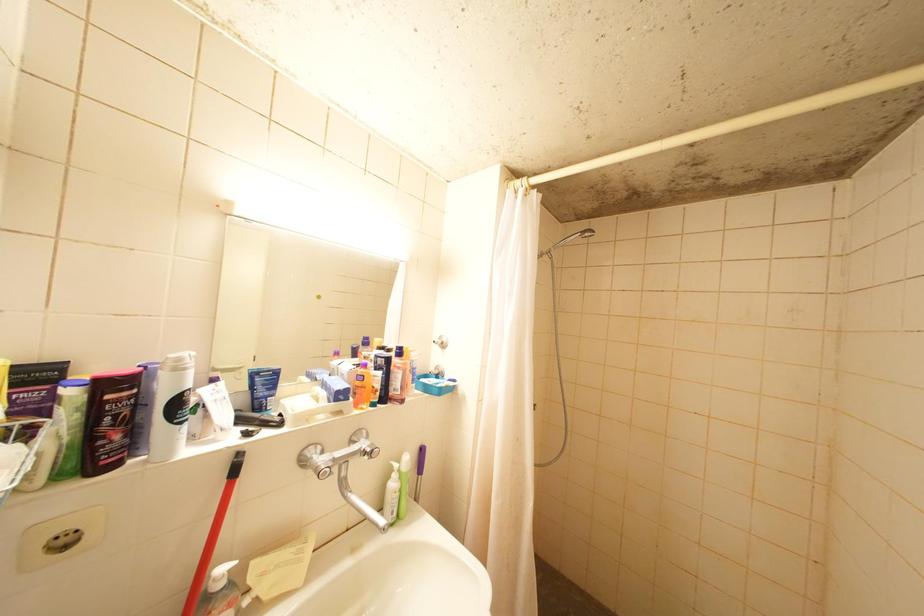
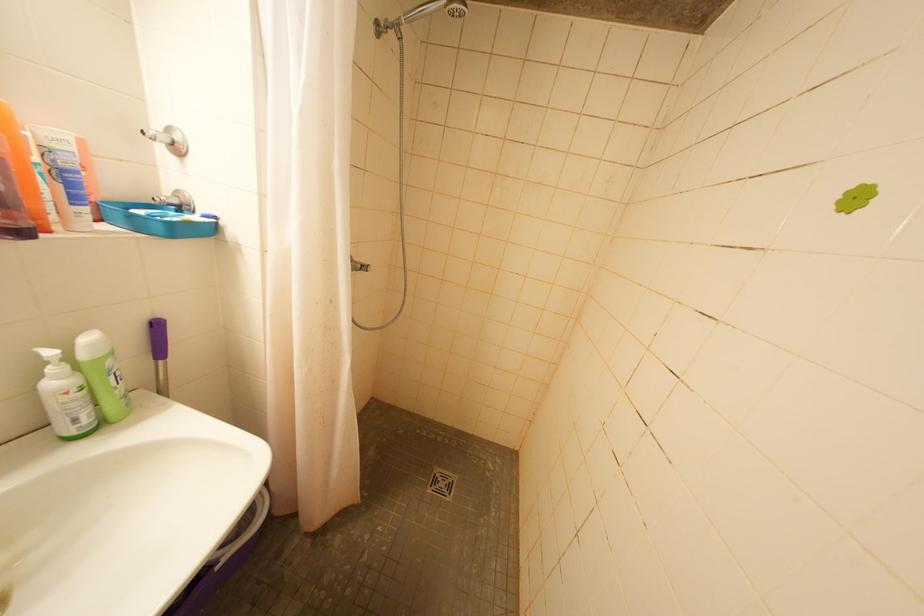
Based on the continuous images, in which direction is the camera rotating?

The camera rotated toward right-down.